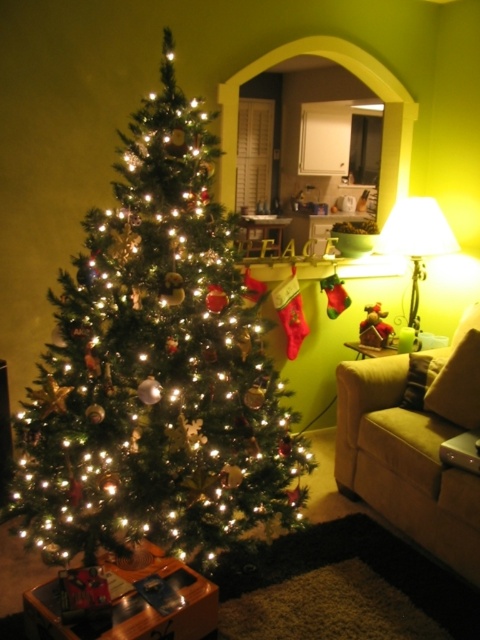
Is green matte christmas tree at left bigger than suede-like beige couch at lower right?

Indeed, green matte christmas tree at left has a larger size compared to suede-like beige couch at lower right.

Between point (27, 513) and point (448, 515), which one is positioned in front?

Point (27, 513) is more forward.

The height and width of the screenshot is (640, 480). Identify the location of green matte christmas tree at left. (157, 369).

Which is more to the right, suede-like beige couch at lower right or white fabric lampshade at right?

Positioned to the right is white fabric lampshade at right.

Does suede-like beige couch at lower right appear over white fabric lampshade at right?

No.

Locate an element on the screen. suede-like beige couch at lower right is located at coordinates (x=415, y=444).

How far apart are green matte christmas tree at left and white fabric lampshade at right?

green matte christmas tree at left is 1.53 meters away from white fabric lampshade at right.

Which of these two, green matte christmas tree at left or white fabric lampshade at right, stands shorter?

white fabric lampshade at right is shorter.

Is point (186, 520) positioned in front of point (415, 314)?

Yes.

This screenshot has height=640, width=480. Identify the location of green matte christmas tree at left. (157, 369).